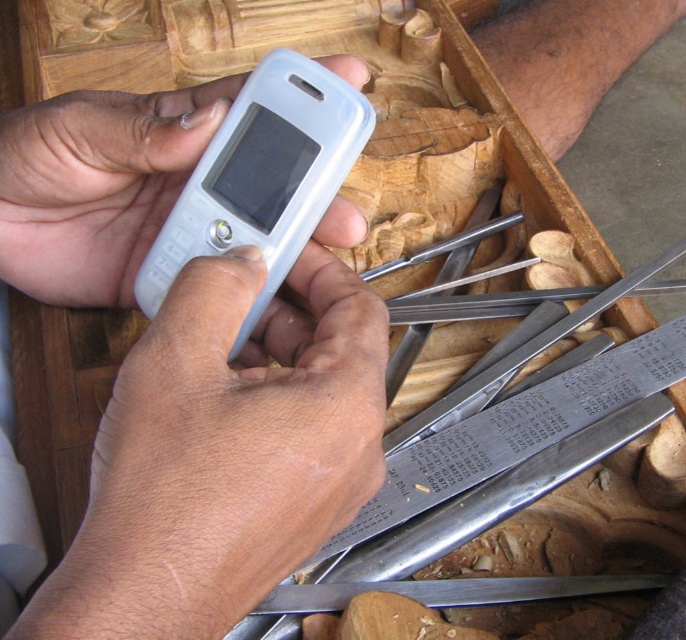
Which is above, white plastic phone at center or white matte phone at center?

Positioned higher is white matte phone at center.

Measure the distance from white plastic phone at center to white matte phone at center.

white plastic phone at center and white matte phone at center are 2.53 inches apart from each other.

This screenshot has width=686, height=640. What do you see at coordinates (224, 449) in the screenshot?
I see `white plastic phone at center` at bounding box center [224, 449].

You are a GUI agent. You are given a task and a screenshot of the screen. Output one action in this format:
    pyautogui.click(x=<x>, y=<y>)
    Task: Click on the white plastic phone at center
    The width and height of the screenshot is (686, 640).
    Given the screenshot: What is the action you would take?
    pyautogui.click(x=224, y=449)